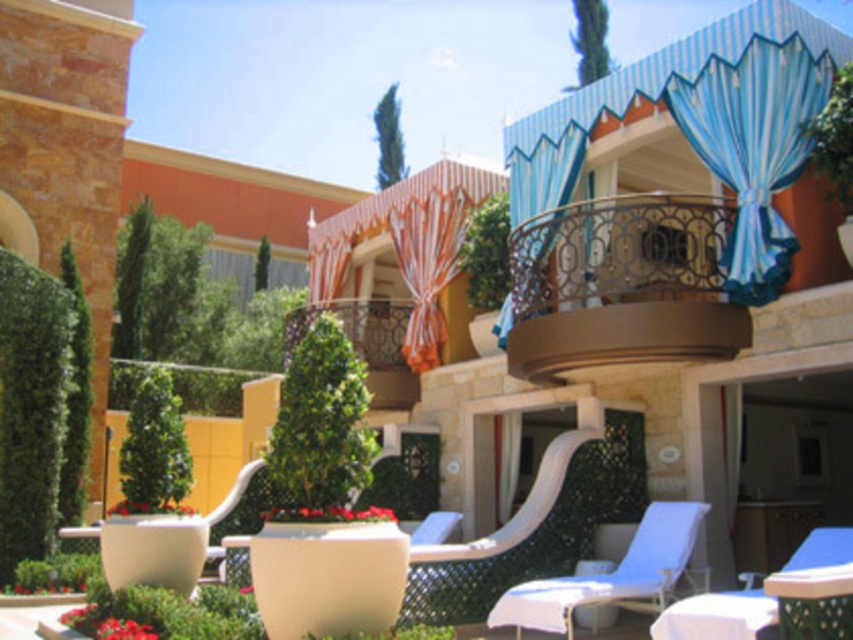
You are standing in the resort area and want to walk from point A to point B. Point A is at coordinates point (x=413, y=400) and point B is at coordinates point (x=271, y=515). Which point is closer to you when you start walking?

Point A at coordinates point (x=413, y=400) is closer to you because it is further to the viewer than point B at coordinates point (x=271, y=515), meaning you can reach it sooner.

You are standing in the resort area and want to know how far the point at coordinates (541, 582) is from your current position. Can you determine the distance?

The point at coordinates (541, 582) is 25.39 meters away from your current position.